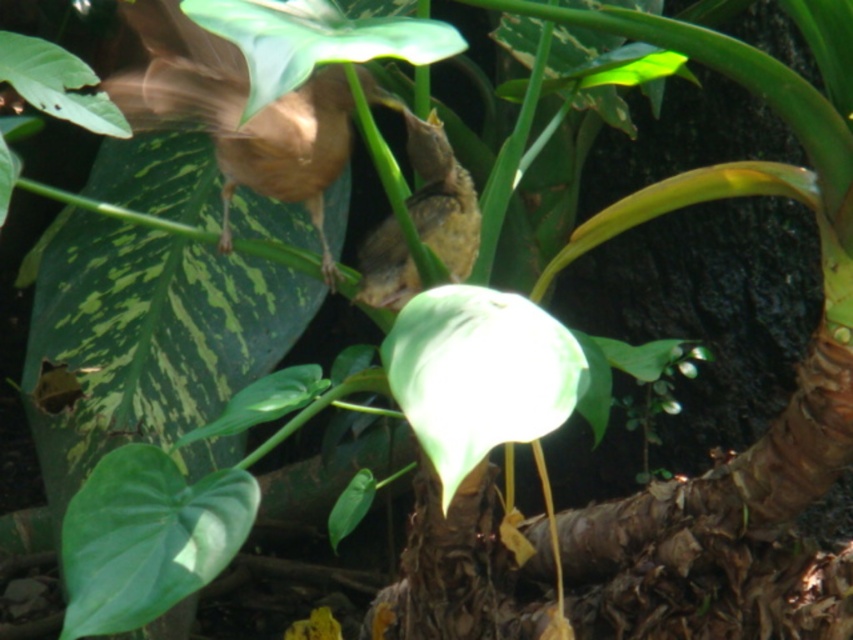
Is green matte leaf at lower left to the left of green matte leaf at upper left from the viewer's perspective?

In fact, green matte leaf at lower left is to the right of green matte leaf at upper left.

Who is more forward, (167, 502) or (80, 118)?

Point (167, 502) is more forward.

In order to click on green matte leaf at lower left in this screenshot , I will do `click(146, 538)`.

Who is shorter, green matte leaf at center or green matte leaf at upper left?

With less height is green matte leaf at upper left.

Who is positioned more to the right, green matte leaf at center or green matte leaf at upper left?

green matte leaf at center

Who is more distant from viewer, (498, 422) or (62, 113)?

The point (62, 113) is behind.

The image size is (853, 640). Find the location of `green matte leaf at center`. green matte leaf at center is located at coordinates (479, 374).

What do you see at coordinates (479, 374) in the screenshot? Image resolution: width=853 pixels, height=640 pixels. I see `green matte leaf at center` at bounding box center [479, 374].

Is point (502, 369) farther from viewer compared to point (222, 13)?

That is False.

Which is in front, point (445, 330) or point (424, 44)?

Point (424, 44) is in front.

Identify the location of green matte leaf at center. (479, 374).